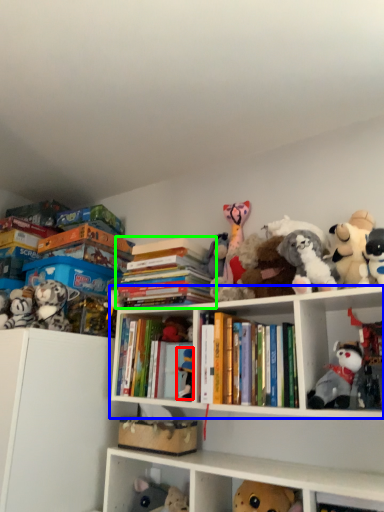
Question: Which object is positioned closest to toy (highlighted by a red box)? Select from cabinet (highlighted by a blue box) and book (highlighted by a green box).

Choices:
 (A) cabinet
 (B) book

Answer: (A)